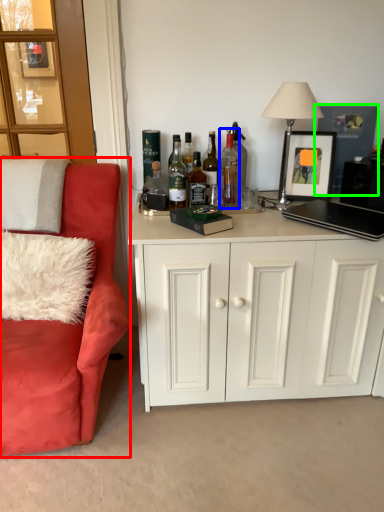
Question: Which is farther away from chair (highlighted by a red box)? bottle (highlighted by a blue box) or picture frame (highlighted by a green box)?

Choices:
 (A) bottle
 (B) picture frame

Answer: (B)